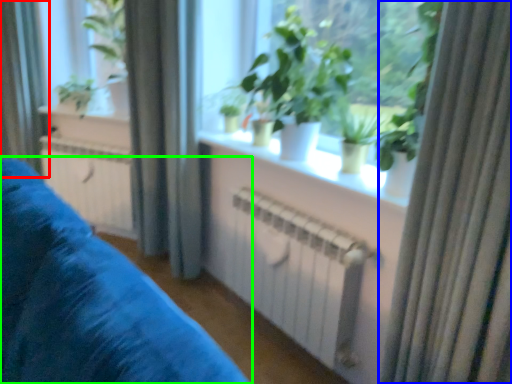
Question: Which object is the farthest from curtain (highlighted by a red box)? Choose among these: curtain (highlighted by a blue box) or furniture (highlighted by a green box).

Choices:
 (A) curtain
 (B) furniture

Answer: (A)